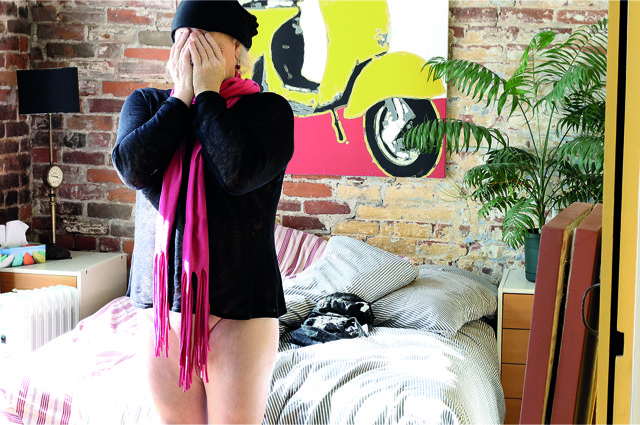
Where is `striped pillow`? striped pillow is located at coordinates (435, 300), (365, 276).